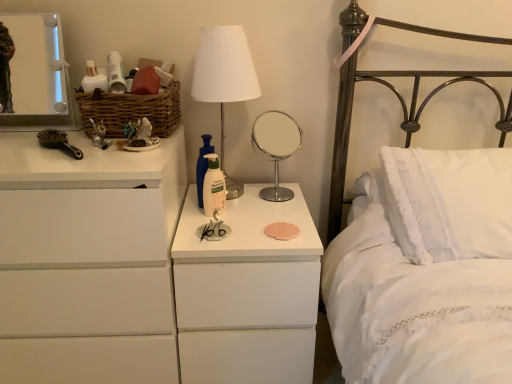
Where is `vacant space in front of matte white figurine at center, which is the 2th toy in left-to-right order`? vacant space in front of matte white figurine at center, which is the 2th toy in left-to-right order is located at coordinates (119, 164).